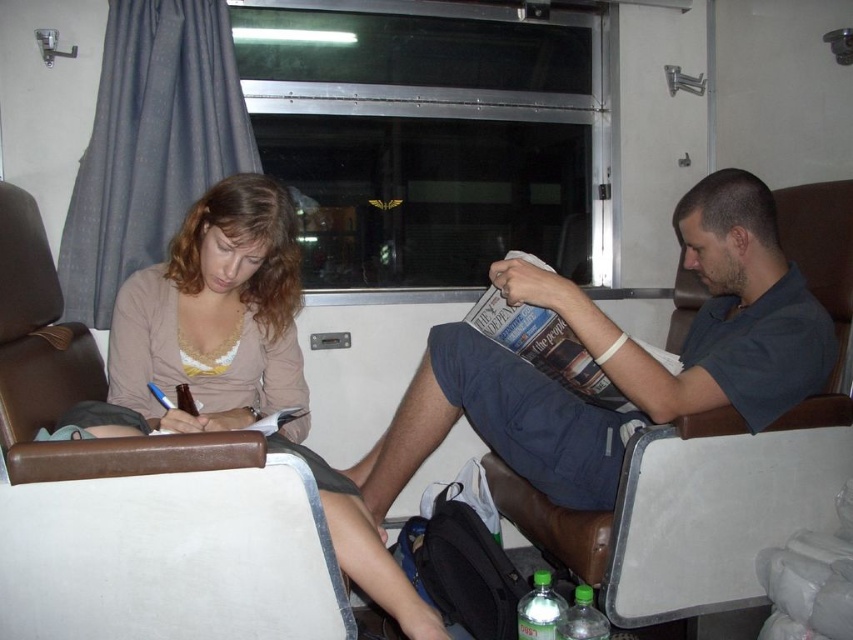
Is brown leather chair at left smaller than matte paper magazine at center?

Incorrect, brown leather chair at left is not smaller in size than matte paper magazine at center.

Is brown leather chair at left further to camera compared to matte paper magazine at center?

A: No, brown leather chair at left is closer to the viewer.

Who is more forward, (86, 497) or (573, 368)?

Point (86, 497) is in front.

At what (x,y) coordinates should I click in order to perform the action: click on brown leather chair at left. Please return your answer as a coordinate pair (x, y). This screenshot has width=853, height=640. Looking at the image, I should click on (137, 499).

Is brown leather chair at left in front of brown leather chair at center?

That is True.

Can you confirm if brown leather chair at left is taller than brown leather chair at center?

In fact, brown leather chair at left may be shorter than brown leather chair at center.

At what (x,y) coordinates should I click in order to perform the action: click on brown leather chair at left. Please return your answer as a coordinate pair (x, y). Looking at the image, I should click on (137, 499).

Is brown leather chair at center bigger than matte paper magazine at center?

Yes, brown leather chair at center is bigger than matte paper magazine at center.

Is point (776, 476) more distant than point (544, 362)?

Yes, point (776, 476) is behind point (544, 362).

Identify the location of brown leather chair at center. This screenshot has height=640, width=853. (712, 474).